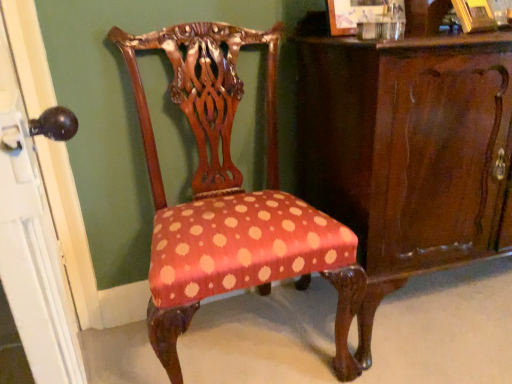
Question: From a real-world perspective, relative to polka dot fabric chair at center, is shiny dark wood vanity at center vertically above or below?

Choices:
 (A) below
 (B) above

Answer: (A)

Question: Considering the positions of point (320, 152) and point (333, 281), is point (320, 152) closer or farther from the camera than point (333, 281)?

Choices:
 (A) farther
 (B) closer

Answer: (A)

Question: Which is farther from the matte black knob at left?

Choices:
 (A) polka dot fabric chair at center
 (B) shiny dark wood vanity at center

Answer: (B)

Question: Which object is positioned closest to the polka dot fabric chair at center?

Choices:
 (A) shiny dark wood vanity at center
 (B) matte black knob at left

Answer: (A)